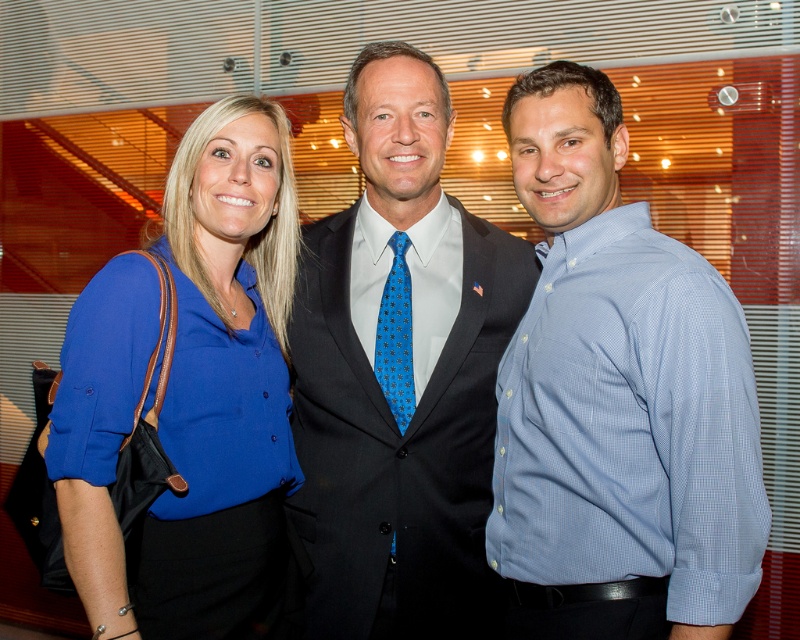
Question: Among these objects, which one is nearest to the camera?

Choices:
 (A) matte black suit at center
 (B) blue fabric shirt at center

Answer: (B)

Question: Is blue fabric shirt at center positioned before blue dotted tie at center?

Choices:
 (A) yes
 (B) no

Answer: (A)

Question: Which point is closer to the camera?

Choices:
 (A) matte black suit at center
 (B) blue checkered shirt at right
 (C) blue fabric shirt at center

Answer: (B)

Question: Does matte black suit at center have a smaller size compared to blue dotted tie at center?

Choices:
 (A) yes
 (B) no

Answer: (B)

Question: Can you confirm if blue fabric shirt at center is bigger than blue dotted tie at center?

Choices:
 (A) no
 (B) yes

Answer: (B)

Question: Which of the following is the farthest from the observer?

Choices:
 (A) (605, 333)
 (B) (184, 467)

Answer: (B)